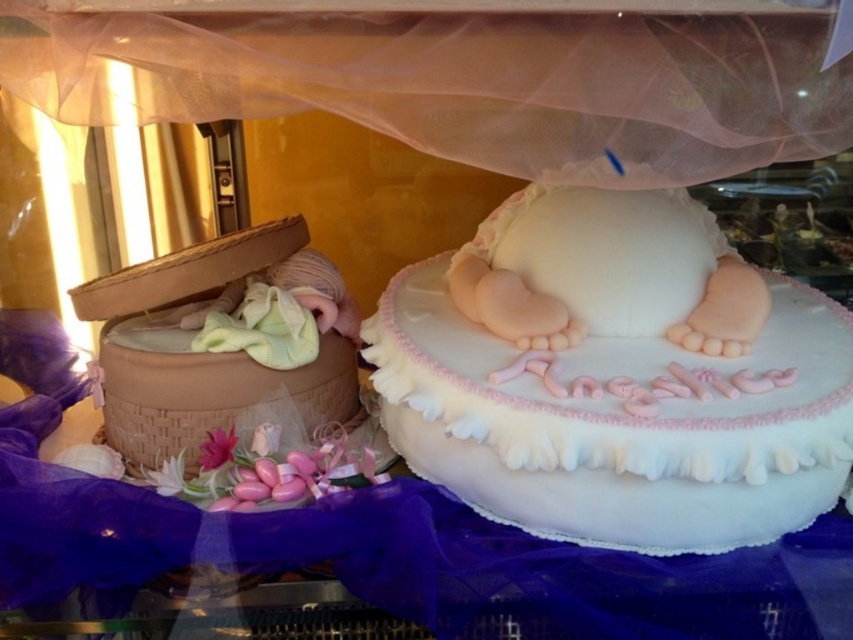
Question: Considering the relative positions of braided wicker basket at left and pink matte flower at lower left in the image provided, where is braided wicker basket at left located with respect to pink matte flower at lower left?

Choices:
 (A) left
 (B) right

Answer: (A)

Question: Which of the following is the farthest from the observer?

Choices:
 (A) pink matte flower at lower left
 (B) braided wicker basket at left
 (C) white fondant cake at center

Answer: (B)

Question: Which point is closer to the camera?

Choices:
 (A) pink matte flower at lower left
 (B) white fondant cake at center
 (C) braided wicker basket at left

Answer: (B)

Question: Can you confirm if white fondant cake at center is positioned to the left of braided wicker basket at left?

Choices:
 (A) yes
 (B) no

Answer: (B)

Question: Based on their relative distances, which object is nearer to the pink matte flower at lower left?

Choices:
 (A) white fondant cake at center
 (B) braided wicker basket at left

Answer: (B)

Question: Is white fondant cake at center in front of braided wicker basket at left?

Choices:
 (A) yes
 (B) no

Answer: (A)